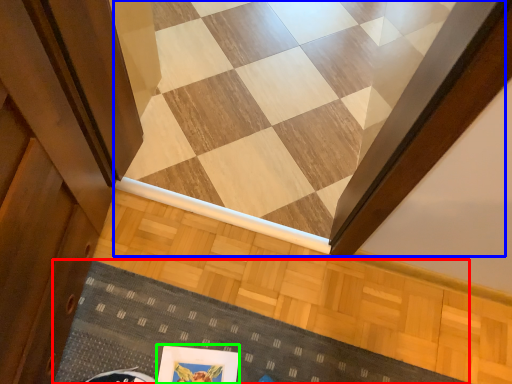
Question: Which is farther away from doormat (highlighted by a red box)? stairwell (highlighted by a blue box) or picture frame (highlighted by a green box)?

Choices:
 (A) stairwell
 (B) picture frame

Answer: (A)